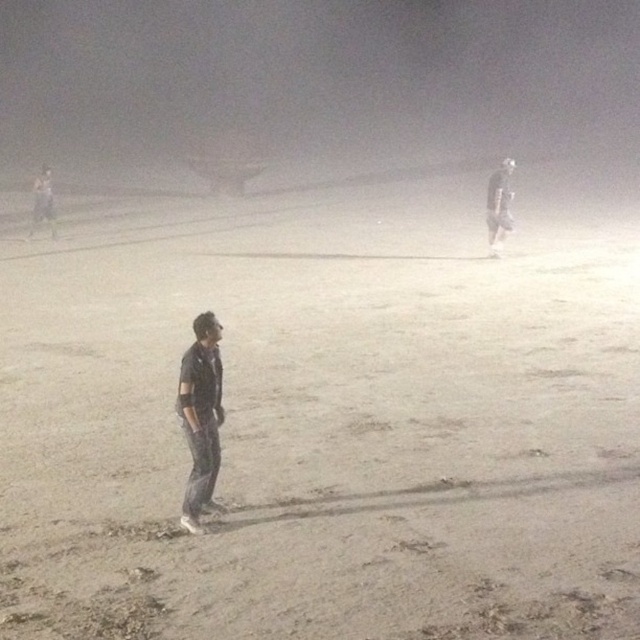
How far apart are gray sandy field at center and dark gray jeans at upper left?

gray sandy field at center and dark gray jeans at upper left are 10.32 meters apart.

Is point (68, 534) in front of point (51, 209)?

Yes, it is.

Where is `gray sandy field at center`? gray sandy field at center is located at coordinates (324, 420).

Can you confirm if gray sandy field at center is positioned below white matte figure at upper right?

Correct, gray sandy field at center is located below white matte figure at upper right.

What do you see at coordinates (324, 420) in the screenshot? The height and width of the screenshot is (640, 640). I see `gray sandy field at center` at bounding box center [324, 420].

This screenshot has width=640, height=640. What are the coordinates of `gray sandy field at center` in the screenshot? It's located at (324, 420).

Is point (579, 344) behind point (209, 346)?

Yes, it is behind point (209, 346).

Can you confirm if gray sandy field at center is positioned to the right of dark blue shirt at center?

Correct, you'll find gray sandy field at center to the right of dark blue shirt at center.

Find the location of a particular element. gray sandy field at center is located at coordinates (324, 420).